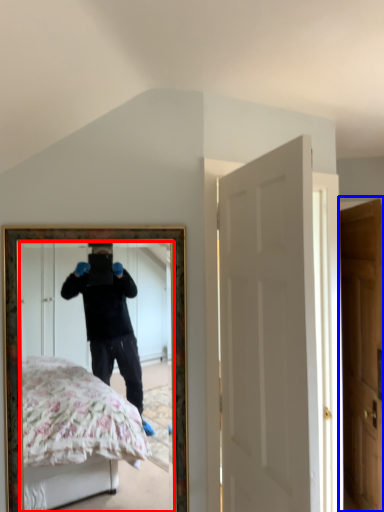
Question: Which point is further to the camera, mirror (highlighted by a red box) or door (highlighted by a blue box)?

Choices:
 (A) mirror
 (B) door

Answer: (B)